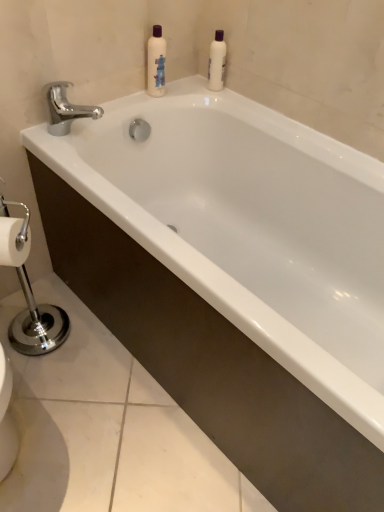
This screenshot has width=384, height=512. In order to click on white glossy bottle at upper center, marked as the second cleaning product in a right-to-left arrangement in this screenshot , I will do `click(156, 62)`.

What is the approximate width of white plastic bottle at upper center, the second cleaning product when ordered from left to right?

It is 2.30 inches.

This screenshot has width=384, height=512. I want to click on white glossy bottle at upper center, marked as the first cleaning product in a left-to-right arrangement, so click(156, 62).

Considering the relative sizes of white glossy bottle at upper center, marked as the second cleaning product in a right-to-left arrangement, and white plastic bottle at upper center, the 1th cleaning product positioned from the right, in the image provided, is white glossy bottle at upper center, marked as the second cleaning product in a right-to-left arrangement, thinner than white plastic bottle at upper center, the 1th cleaning product positioned from the right,?

In fact, white glossy bottle at upper center, marked as the second cleaning product in a right-to-left arrangement, might be wider than white plastic bottle at upper center, the 1th cleaning product positioned from the right.

Does white glossy bottle at upper center, marked as the second cleaning product in a right-to-left arrangement, appear on the right side of white plastic bottle at upper center, the 1th cleaning product positioned from the right?

Incorrect, white glossy bottle at upper center, marked as the second cleaning product in a right-to-left arrangement, is not on the right side of white plastic bottle at upper center, the 1th cleaning product positioned from the right.

Is white plastic bottle at upper center, the 1th cleaning product positioned from the right, completely or partially inside white glossy bottle at upper center, marked as the second cleaning product in a right-to-left arrangement?

No, white plastic bottle at upper center, the 1th cleaning product positioned from the right, is not surrounded by white glossy bottle at upper center, marked as the second cleaning product in a right-to-left arrangement.

Can you tell me how much white glossy bottle at upper center, marked as the first cleaning product in a left-to-right arrangement, and white plastic bottle at upper center, the second cleaning product when ordered from left to right, differ in facing direction?

86.6 degrees.

Considering the sizes of white plastic bottle at upper center, the second cleaning product when ordered from left to right, and chrome/metallic faucet at upper left in the image, is white plastic bottle at upper center, the second cleaning product when ordered from left to right, wider or thinner than chrome/metallic faucet at upper left?

white plastic bottle at upper center, the second cleaning product when ordered from left to right, is thinner than chrome/metallic faucet at upper left.

From the image's perspective, which one is positioned lower, white plastic bottle at upper center, the second cleaning product when ordered from left to right, or chrome/metallic faucet at upper left?

chrome/metallic faucet at upper left is shown below in the image.

From the picture: What's the angular difference between white plastic bottle at upper center, the 1th cleaning product positioned from the right, and chrome/metallic faucet at upper left's facing directions?

white plastic bottle at upper center, the 1th cleaning product positioned from the right, and chrome/metallic faucet at upper left are facing 86.6 degrees away from each other.

In terms of height, does white plastic bottle at upper center, the 1th cleaning product positioned from the right, look taller or shorter compared to chrome/metallic faucet at upper left?

In the image, white plastic bottle at upper center, the 1th cleaning product positioned from the right, appears to be taller than chrome/metallic faucet at upper left.

Is white plastic bottle at upper center, the second cleaning product when ordered from left to right, positioned with its back to white glossy bottle at upper center, marked as the second cleaning product in a right-to-left arrangement?

white plastic bottle at upper center, the second cleaning product when ordered from left to right, is not turned away from white glossy bottle at upper center, marked as the second cleaning product in a right-to-left arrangement.

Is white plastic bottle at upper center, the 1th cleaning product positioned from the right, inside the boundaries of white glossy bottle at upper center, marked as the second cleaning product in a right-to-left arrangement, or outside?

white plastic bottle at upper center, the 1th cleaning product positioned from the right, is not enclosed by white glossy bottle at upper center, marked as the second cleaning product in a right-to-left arrangement.

From the image's perspective, who appears lower, white plastic bottle at upper center, the second cleaning product when ordered from left to right, or white glossy bottle at upper center, marked as the second cleaning product in a right-to-left arrangement?

white glossy bottle at upper center, marked as the second cleaning product in a right-to-left arrangement, appears lower in the image.

Is white plastic bottle at upper center, the second cleaning product when ordered from left to right, with white glossy bottle at upper center, marked as the first cleaning product in a left-to-right arrangement?

No, white plastic bottle at upper center, the second cleaning product when ordered from left to right, is not beside white glossy bottle at upper center, marked as the first cleaning product in a left-to-right arrangement.

Which is more to the right, white glossy bottle at upper center, marked as the first cleaning product in a left-to-right arrangement, or chrome/metallic faucet at upper left?

From the viewer's perspective, white glossy bottle at upper center, marked as the first cleaning product in a left-to-right arrangement, appears more on the right side.

Does white glossy bottle at upper center, marked as the first cleaning product in a left-to-right arrangement, touch chrome/metallic faucet at upper left?

No, white glossy bottle at upper center, marked as the first cleaning product in a left-to-right arrangement, is not next to chrome/metallic faucet at upper left.

From the image's perspective, which object appears higher, white glossy bottle at upper center, marked as the first cleaning product in a left-to-right arrangement, or chrome/metallic faucet at upper left?

white glossy bottle at upper center, marked as the first cleaning product in a left-to-right arrangement, appears higher in the image.

What are the coordinates of `tap lying on the left of white glossy bottle at upper center, marked as the first cleaning product in a left-to-right arrangement` in the screenshot? It's located at (66, 109).

Does chrome/metallic faucet at upper left have a smaller size compared to white plastic bottle at upper center, the second cleaning product when ordered from left to right?

Incorrect, chrome/metallic faucet at upper left is not smaller in size than white plastic bottle at upper center, the second cleaning product when ordered from left to right.

From a real-world perspective, which is physically above, chrome/metallic faucet at upper left or white plastic bottle at upper center, the second cleaning product when ordered from left to right?

white plastic bottle at upper center, the second cleaning product when ordered from left to right.

From a real-world perspective, count 1st cleaning products upward from the chrome/metallic faucet at upper left and point to it. Please provide its 2D coordinates.

[(217, 62)]

Locate an element on the screen. the 1st cleaning product positioned above the chrome/metallic faucet at upper left (from the image's perspective) is located at coordinates (156, 62).

Could you tell me if chrome/metallic faucet at upper left is facing white glossy bottle at upper center, marked as the first cleaning product in a left-to-right arrangement?

No, chrome/metallic faucet at upper left is not oriented towards white glossy bottle at upper center, marked as the first cleaning product in a left-to-right arrangement.

From a real-world perspective, which object rests below the other?

chrome/metallic faucet at upper left is physically lower.

There is a white plastic bottle at upper center, the 1th cleaning product positioned from the right. Where is `cleaning product above it (from a real-world perspective)`? This screenshot has width=384, height=512. cleaning product above it (from a real-world perspective) is located at coordinates (156, 62).

From the image's perspective, count 2nd cleaning products upward from the chrome/metallic faucet at upper left and point to it. Please provide its 2D coordinates.

[(217, 62)]

From the image, which object appears to be farther from chrome/metallic faucet at upper left, white glossy bottle at upper center, marked as the second cleaning product in a right-to-left arrangement, or white plastic bottle at upper center, the 1th cleaning product positioned from the right?

Among the two, white plastic bottle at upper center, the 1th cleaning product positioned from the right, is located further to chrome/metallic faucet at upper left.

Looking at the image, which one is located further to chrome/metallic faucet at upper left, white plastic bottle at upper center, the 1th cleaning product positioned from the right, or white glossy bottle at upper center, marked as the second cleaning product in a right-to-left arrangement?

Based on the image, white plastic bottle at upper center, the 1th cleaning product positioned from the right, appears to be further to chrome/metallic faucet at upper left.

Considering their positions, is white glossy bottle at upper center, marked as the first cleaning product in a left-to-right arrangement, positioned closer to white plastic bottle at upper center, the 1th cleaning product positioned from the right, than chrome/metallic faucet at upper left?

white glossy bottle at upper center, marked as the first cleaning product in a left-to-right arrangement, lies closer to white plastic bottle at upper center, the 1th cleaning product positioned from the right, than the other object.

Considering their positions, is white plastic bottle at upper center, the 1th cleaning product positioned from the right, positioned closer to white glossy bottle at upper center, marked as the second cleaning product in a right-to-left arrangement, than chrome/metallic faucet at upper left?

Based on the image, white plastic bottle at upper center, the 1th cleaning product positioned from the right, appears to be nearer to white glossy bottle at upper center, marked as the second cleaning product in a right-to-left arrangement.

Looking at the image, which one is located closer to white plastic bottle at upper center, the 1th cleaning product positioned from the right, chrome/metallic faucet at upper left or white glossy bottle at upper center, marked as the second cleaning product in a right-to-left arrangement?

white glossy bottle at upper center, marked as the second cleaning product in a right-to-left arrangement, is closer to white plastic bottle at upper center, the 1th cleaning product positioned from the right.

Considering their positions, is chrome/metallic faucet at upper left positioned closer to white glossy bottle at upper center, marked as the second cleaning product in a right-to-left arrangement, than white plastic bottle at upper center, the 1th cleaning product positioned from the right?

white plastic bottle at upper center, the 1th cleaning product positioned from the right, is closer to white glossy bottle at upper center, marked as the second cleaning product in a right-to-left arrangement.

At what (x,y) coordinates should I click in order to perform the action: click on cleaning product between chrome/metallic faucet at upper left and white plastic bottle at upper center, the second cleaning product when ordered from left to right, in the horizontal direction. Please return your answer as a coordinate pair (x, y). The image size is (384, 512). Looking at the image, I should click on (156, 62).